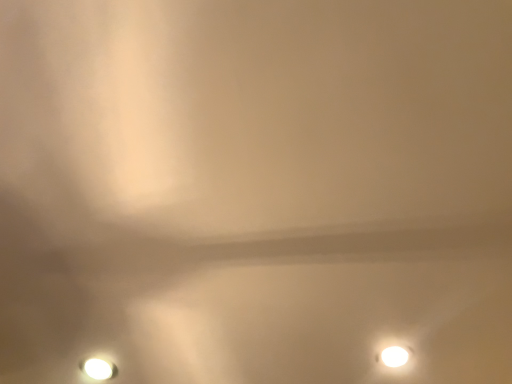
Question: From the image's perspective, is white glossy lamp at lower right, which is the first lamp in right-to-left order, located beneath white glossy lamp at lower left, the first lamp positioned from the left?

Choices:
 (A) no
 (B) yes

Answer: (A)

Question: Does white glossy lamp at lower right, arranged as the 2th lamp when viewed from the left, have a lesser height compared to white glossy lamp at lower left, acting as the second lamp starting from the right?

Choices:
 (A) no
 (B) yes

Answer: (A)

Question: Is white glossy lamp at lower right, which is the first lamp in right-to-left order, aimed at white glossy lamp at lower left, acting as the second lamp starting from the right?

Choices:
 (A) no
 (B) yes

Answer: (B)

Question: Can you confirm if white glossy lamp at lower right, arranged as the 2th lamp when viewed from the left, is smaller than white glossy lamp at lower left, the first lamp positioned from the left?

Choices:
 (A) no
 (B) yes

Answer: (A)

Question: Can you confirm if white glossy lamp at lower right, arranged as the 2th lamp when viewed from the left, is wider than white glossy lamp at lower left, acting as the second lamp starting from the right?

Choices:
 (A) no
 (B) yes

Answer: (A)

Question: Is white glossy lamp at lower right, arranged as the 2th lamp when viewed from the left, bigger than white glossy lamp at lower left, acting as the second lamp starting from the right?

Choices:
 (A) no
 (B) yes

Answer: (B)

Question: Is white glossy lamp at lower left, acting as the second lamp starting from the right, closer to the viewer compared to white glossy lamp at lower right, which is the first lamp in right-to-left order?

Choices:
 (A) yes
 (B) no

Answer: (B)

Question: Is white glossy lamp at lower left, the first lamp positioned from the left, facing towards white glossy lamp at lower right, arranged as the 2th lamp when viewed from the left?

Choices:
 (A) no
 (B) yes

Answer: (B)

Question: Considering the relative sizes of white glossy lamp at lower left, acting as the second lamp starting from the right, and white glossy lamp at lower right, which is the first lamp in right-to-left order, in the image provided, is white glossy lamp at lower left, acting as the second lamp starting from the right, taller than white glossy lamp at lower right, which is the first lamp in right-to-left order,?

Choices:
 (A) yes
 (B) no

Answer: (B)

Question: Is white glossy lamp at lower left, acting as the second lamp starting from the right, smaller than white glossy lamp at lower right, arranged as the 2th lamp when viewed from the left?

Choices:
 (A) no
 (B) yes

Answer: (B)

Question: From the image's perspective, would you say white glossy lamp at lower left, acting as the second lamp starting from the right, is shown under white glossy lamp at lower right, arranged as the 2th lamp when viewed from the left?

Choices:
 (A) yes
 (B) no

Answer: (A)

Question: Does white glossy lamp at lower left, the first lamp positioned from the left, appear on the left side of white glossy lamp at lower right, which is the first lamp in right-to-left order?

Choices:
 (A) yes
 (B) no

Answer: (A)

Question: From the image's perspective, relative to white glossy lamp at lower right, which is the first lamp in right-to-left order, is white glossy lamp at lower left, acting as the second lamp starting from the right, above or below?

Choices:
 (A) above
 (B) below

Answer: (B)